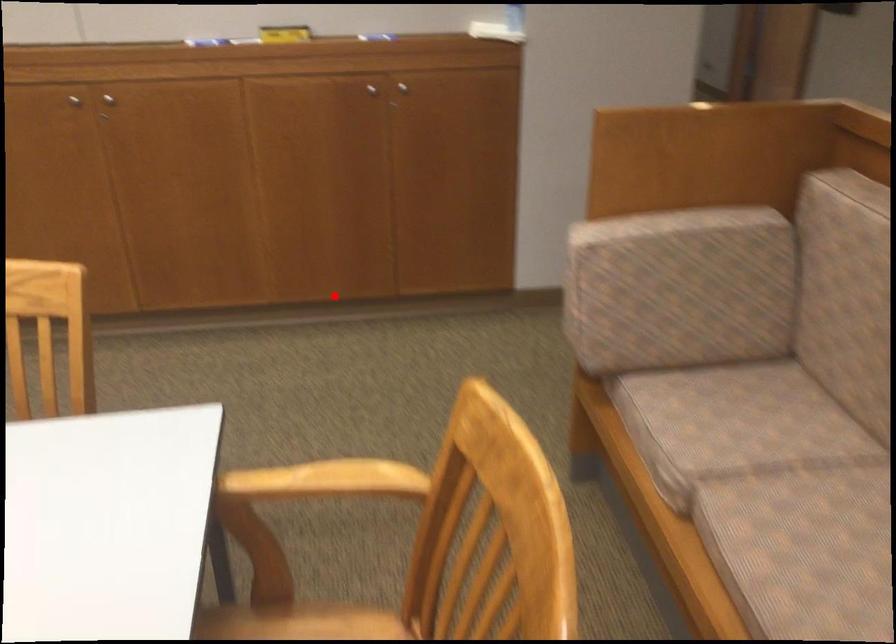
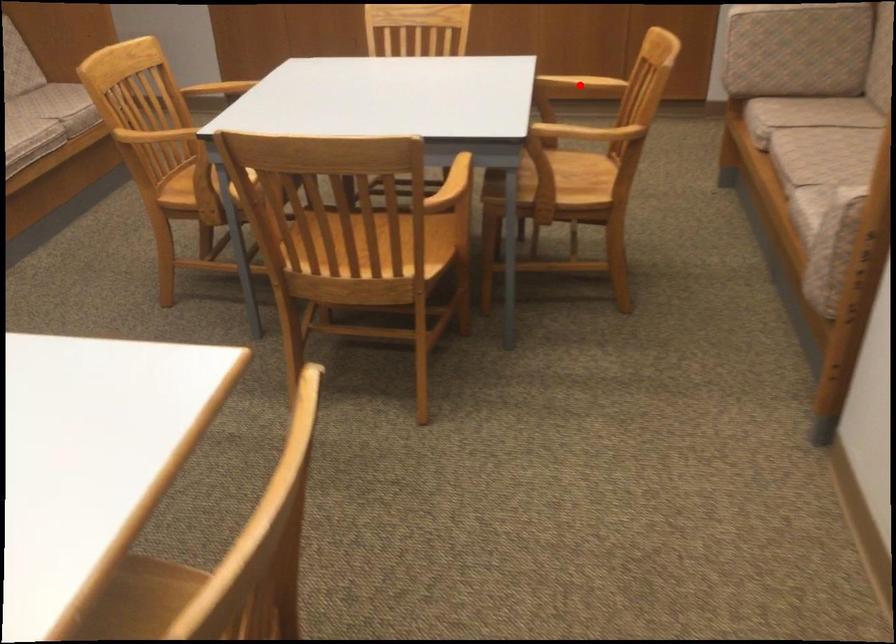
I am providing you with two images of the same scene from different viewpoints. A red point is marked on the first image and another point is marked on the second image. Is the marked point in image1 the same physical position as the marked point in image2?

Yes